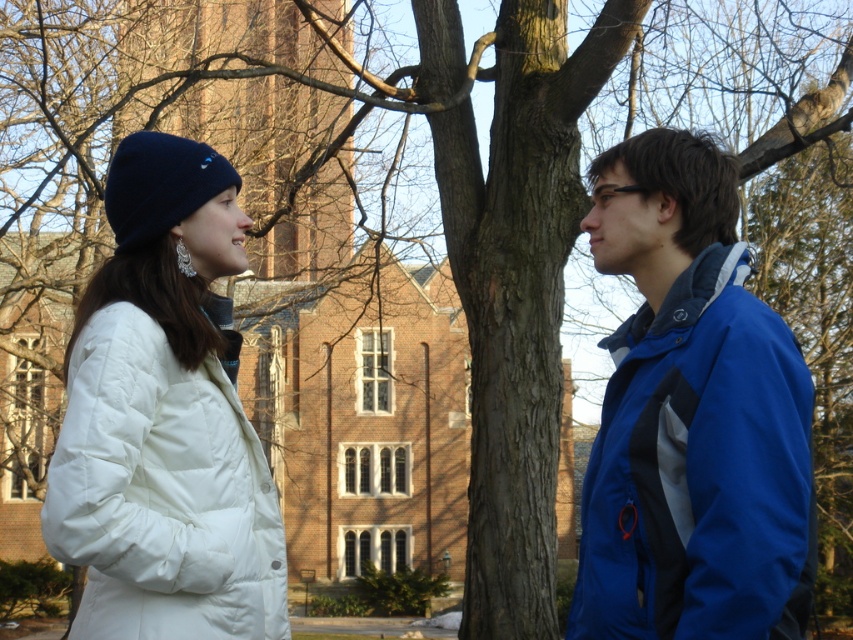
Which is below, blue softshell jacket at right or white puffy coat at left?

white puffy coat at left

Is point (628, 356) more distant than point (155, 416)?

Yes, point (628, 356) is behind point (155, 416).

Does point (612, 611) lie behind point (257, 621)?

No, it is in front of (257, 621).

The width and height of the screenshot is (853, 640). I want to click on blue softshell jacket at right, so click(691, 417).